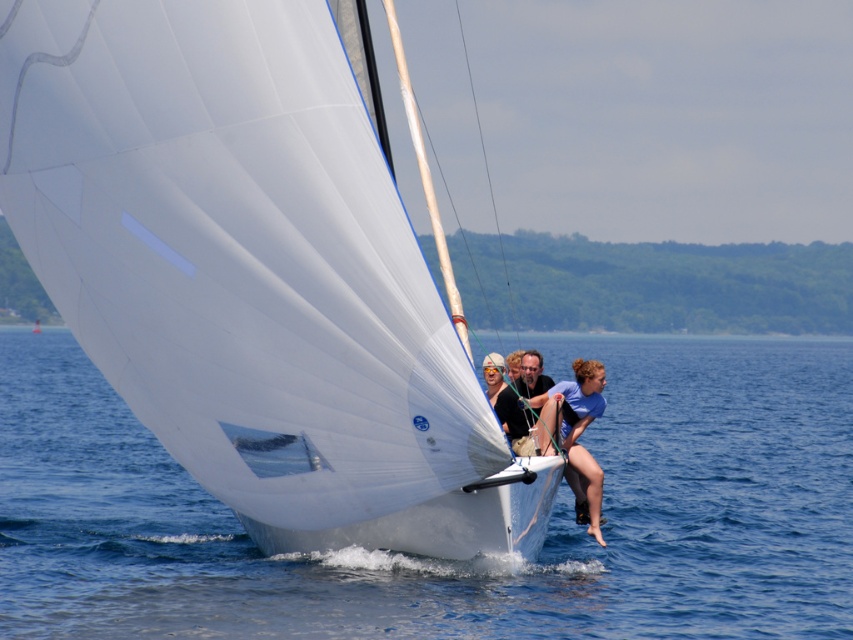
Question: Estimate the real-world distances between objects in this image. Which object is closer to the blue water at sailboat right?

Choices:
 (A) matte black shorts at center
 (B) white matte sailboat at center

Answer: (B)

Question: Is blue water at sailboat right further to camera compared to matte black shorts at center?

Choices:
 (A) no
 (B) yes

Answer: (A)

Question: Considering the relative positions of white matte sailboat at center and blue water at sailboat right in the image provided, where is white matte sailboat at center located with respect to blue water at sailboat right?

Choices:
 (A) above
 (B) below

Answer: (A)

Question: Can you confirm if white matte sailboat at center is thinner than matte black shorts at center?

Choices:
 (A) yes
 (B) no

Answer: (B)

Question: Which of the following is the closest to the observer?

Choices:
 (A) blue water at sailboat right
 (B) matte black shorts at center

Answer: (A)

Question: Among these points, which one is nearest to the camera?

Choices:
 (A) pos(311,188)
 (B) pos(546,444)
 (C) pos(590,349)

Answer: (A)